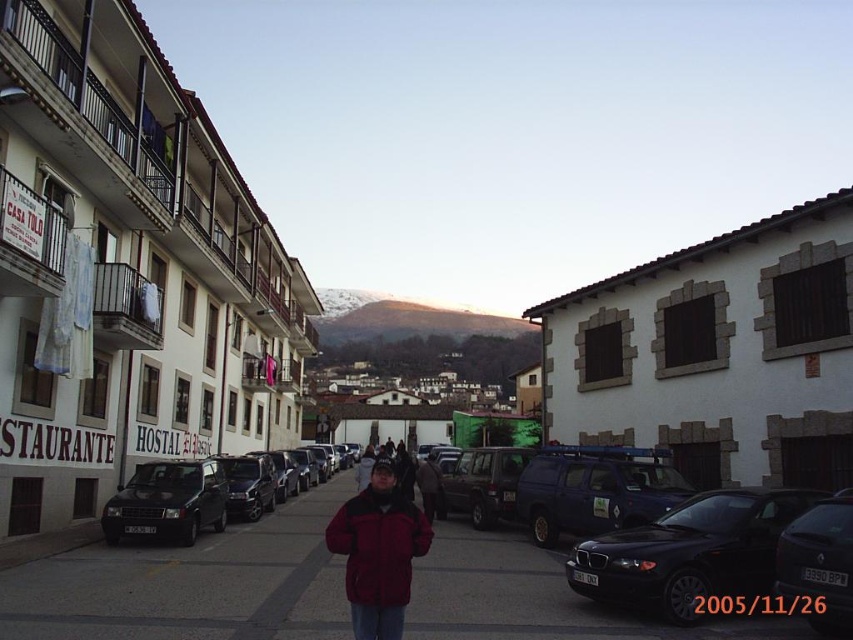
Is shiny black sedan at center further to the viewer compared to dark red fleece jacket at center?

Yes.

Between point (711, 586) and point (369, 595), which one is positioned in front?

Point (369, 595)

Where is `shiny black sedan at center`? The height and width of the screenshot is (640, 853). shiny black sedan at center is located at coordinates (689, 552).

Is the position of dark gray concrete pavement at center less distant than that of dark red fleece jacket at center?

Yes, dark gray concrete pavement at center is in front of dark red fleece jacket at center.

Does dark gray concrete pavement at center come behind dark red fleece jacket at center?

No, dark gray concrete pavement at center is closer to the viewer.

What are the coordinates of `dark gray concrete pavement at center` in the screenshot? It's located at (190, 584).

Who is shorter, shiny black sedan at center or matte black van at left?

With less height is matte black van at left.

Who is higher up, shiny black sedan at center or matte black van at left?

shiny black sedan at center is above.

The height and width of the screenshot is (640, 853). Identify the location of shiny black sedan at center. (689, 552).